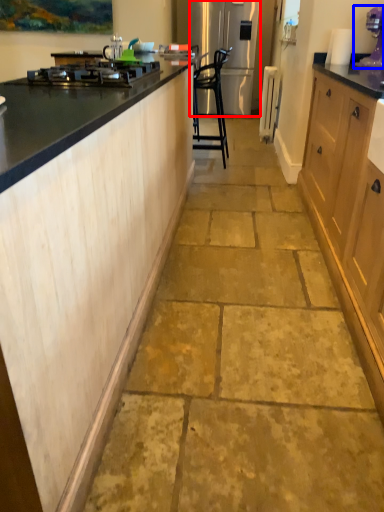
Question: Which object appears closest to the camera in this image, refrigerator (highlighted by a red box) or kitchen appliance (highlighted by a blue box)?

Choices:
 (A) refrigerator
 (B) kitchen appliance

Answer: (B)